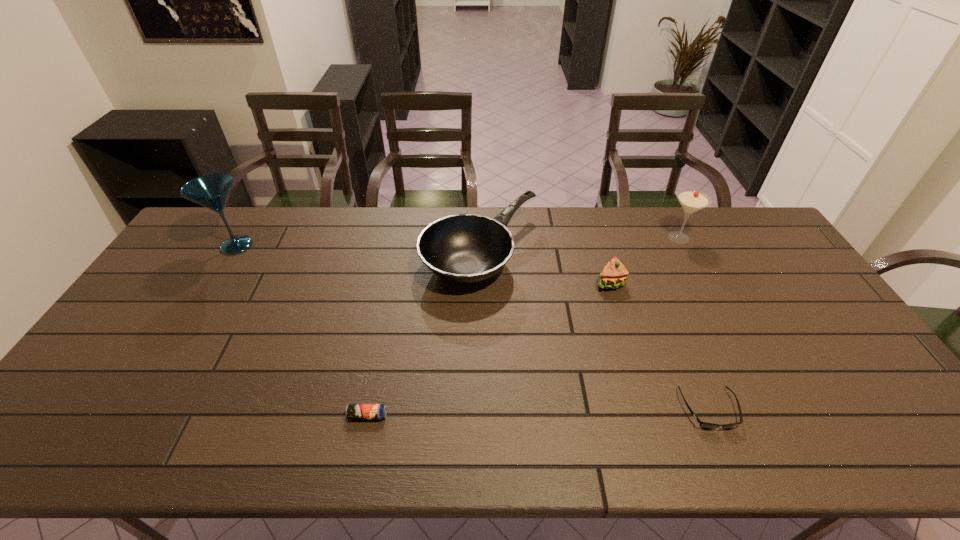
The width and height of the screenshot is (960, 540). Find the location of `vacant space located 0.050m on the back of the left martini`. vacant space located 0.050m on the back of the left martini is located at coordinates (251, 223).

You are a GUI agent. You are given a task and a screenshot of the screen. Output one action in this format:
    pyautogui.click(x=<x>, y=<y>)
    Task: Click on the vacant area situated on the left of the right martini
    The image size is (960, 540).
    Given the screenshot: What is the action you would take?
    pyautogui.click(x=596, y=238)

Where is `vacant space located 0.290m on the left of the fourth object from right to left`? vacant space located 0.290m on the left of the fourth object from right to left is located at coordinates (334, 254).

The height and width of the screenshot is (540, 960). I want to click on vacant space situated on the front of the third object from right to left, so click(631, 354).

The height and width of the screenshot is (540, 960). Find the location of `vacant space situated 0.120m on the left of the beer can`. vacant space situated 0.120m on the left of the beer can is located at coordinates (298, 416).

You are a GUI agent. You are given a task and a screenshot of the screen. Output one action in this format:
    pyautogui.click(x=<x>, y=<y>)
    Task: Click on the frying pan present at the far edge
    
    Given the screenshot: What is the action you would take?
    pyautogui.click(x=463, y=248)

Find the location of a particular element. Image resolution: width=960 pixels, height=540 pixels. beer can present at the near edge is located at coordinates (353, 411).

The width and height of the screenshot is (960, 540). I want to click on sunglasses at the near edge, so click(x=705, y=425).

Locate an element on the screen. Image resolution: width=960 pixels, height=540 pixels. object that is positioned at the left edge is located at coordinates (212, 191).

You are a GUI agent. You are given a task and a screenshot of the screen. Output one action in this format:
    pyautogui.click(x=<x>, y=<y>)
    Task: Click on the object that is at the far left corner
    This screenshot has width=960, height=540.
    Given the screenshot: What is the action you would take?
    pyautogui.click(x=212, y=191)